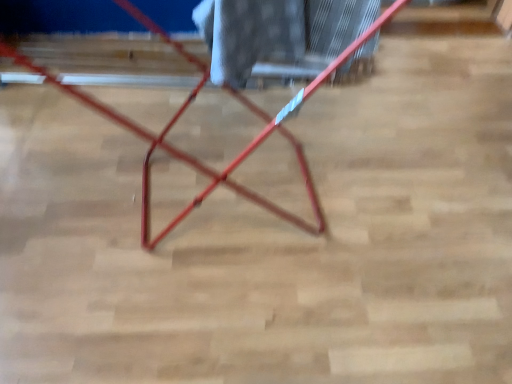
At what (x,y) coordinates should I click in order to perform the action: click on vacant space in metallic red ladder at center (from a real-world perspective). Please return your answer as a coordinate pair (x, y). Looking at the image, I should click on click(192, 200).